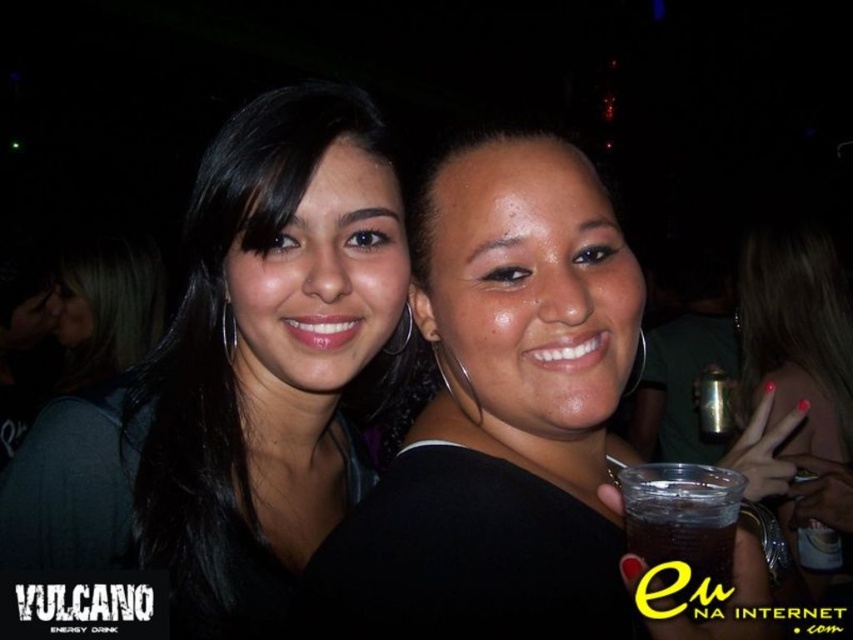
From the picture: You are at a party and want to grab your drink without moving your hand too much. The drink is the translucent plastic cup at lower right. However, your hand is currently holding the matte black shirt at center. Can you reach the drink without moving your hand much?

The matte black shirt at center is in front of the translucent plastic cup at lower right, so you would need to move your hand to adjust the position of the matte black shirt at center to access the translucent plastic cup at lower right.

You are a photographer at a party and want to ensure both the black hair at center and the matte black shirt at center are clearly visible in your photo. Given their height difference, which object should you focus on first to ensure proper exposure?

The black hair at center is much taller than the matte black shirt at center, so you should focus on the black hair at center first to ensure proper exposure.